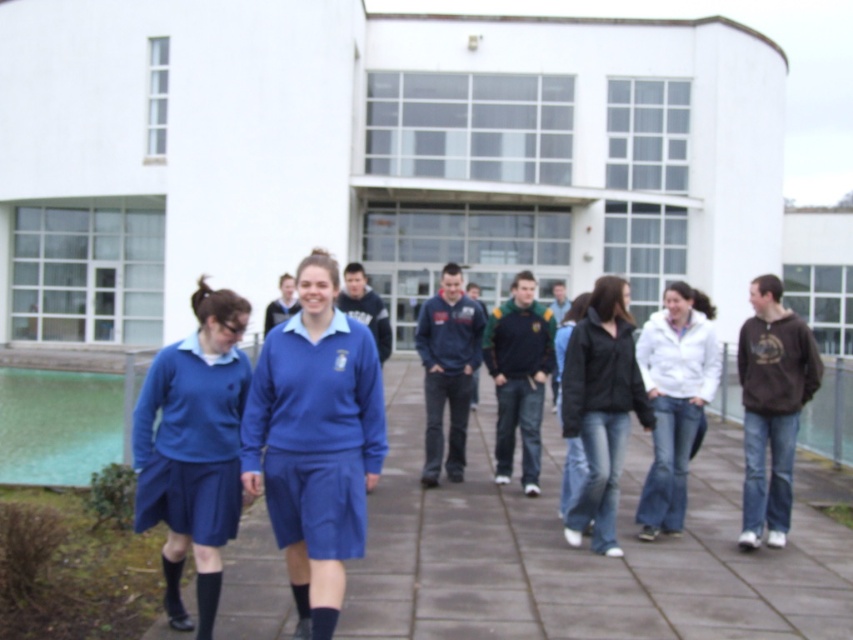
You are a photographer standing to the right of the group. You want to capture both the matte blue uniform at center and the black matte jacket at center in a single frame. Based on their sizes, which one might require you to adjust your camera angle more to ensure both are fully visible?

Answer: The matte blue uniform at center might be wider than the black matte jacket at center, so you might need to adjust your camera angle more to accommodate its width to ensure both are fully visible.